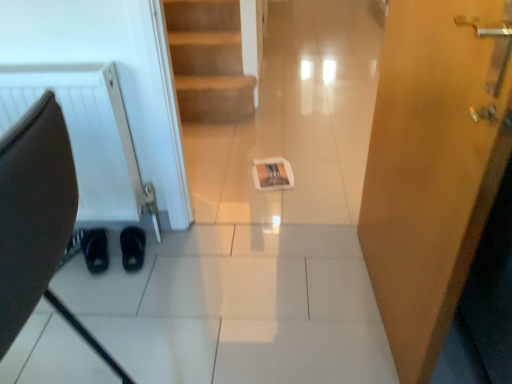
Image resolution: width=512 pixels, height=384 pixels. In order to click on free space between matte paper magazine at center and black suede shoes at lower left, which is the 2th footwear in right-to-left order in this screenshot , I will do `click(214, 204)`.